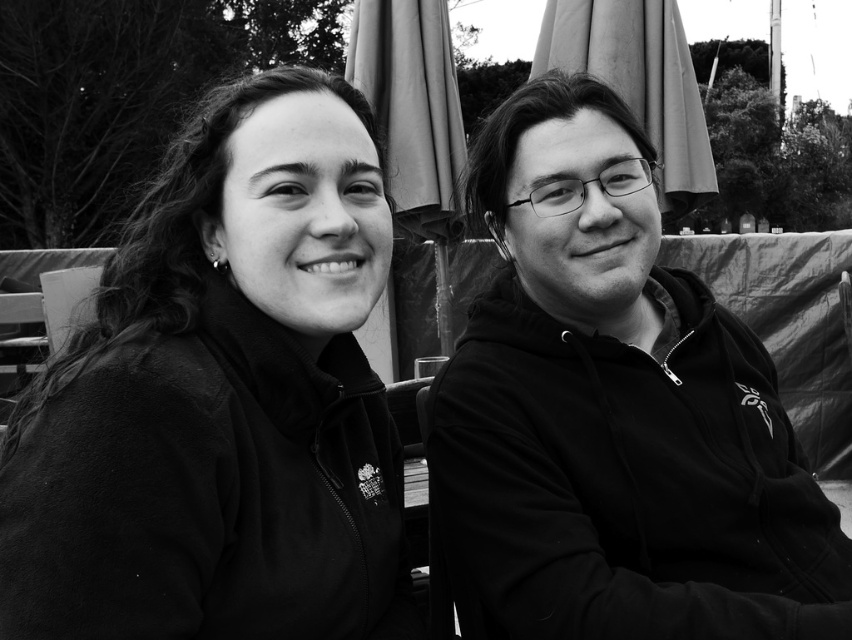
Is matte black jacket at left wider than black zip-up hoodie at center?

No.

Does matte black jacket at left appear over black zip-up hoodie at center?

Incorrect, matte black jacket at left is not positioned above black zip-up hoodie at center.

Does point (136, 336) come farther from viewer compared to point (620, 588)?

No, it is not.

Image resolution: width=852 pixels, height=640 pixels. I want to click on matte black jacket at left, so click(x=217, y=413).